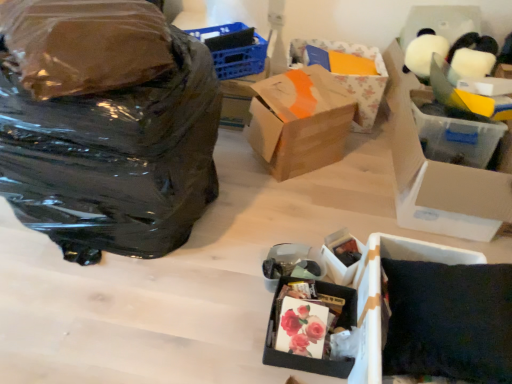
Locate an element on the screen. Image resolution: width=512 pixels, height=384 pixels. free space to the left of matte black box at lower center, which appears as the first box when ordered from the bottom is located at coordinates (232, 322).